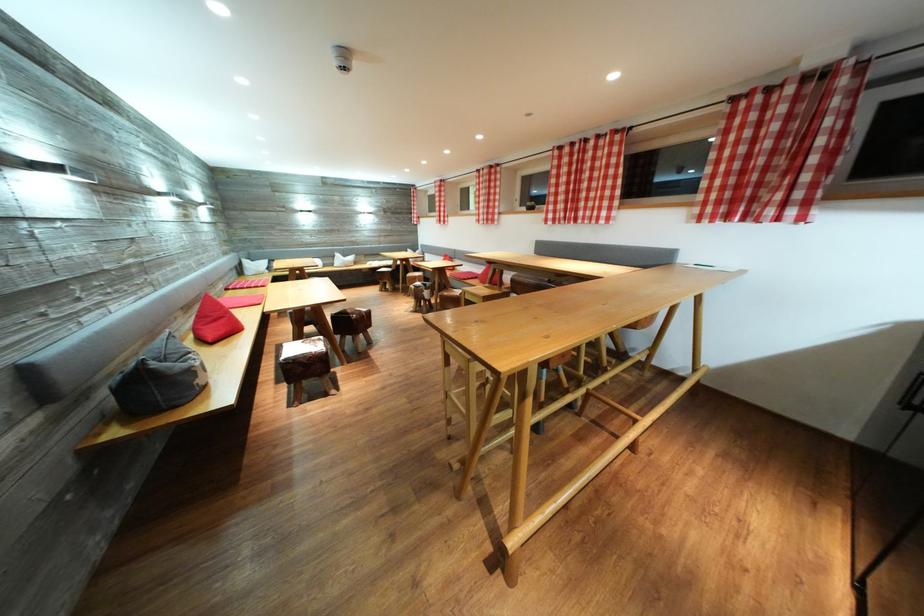
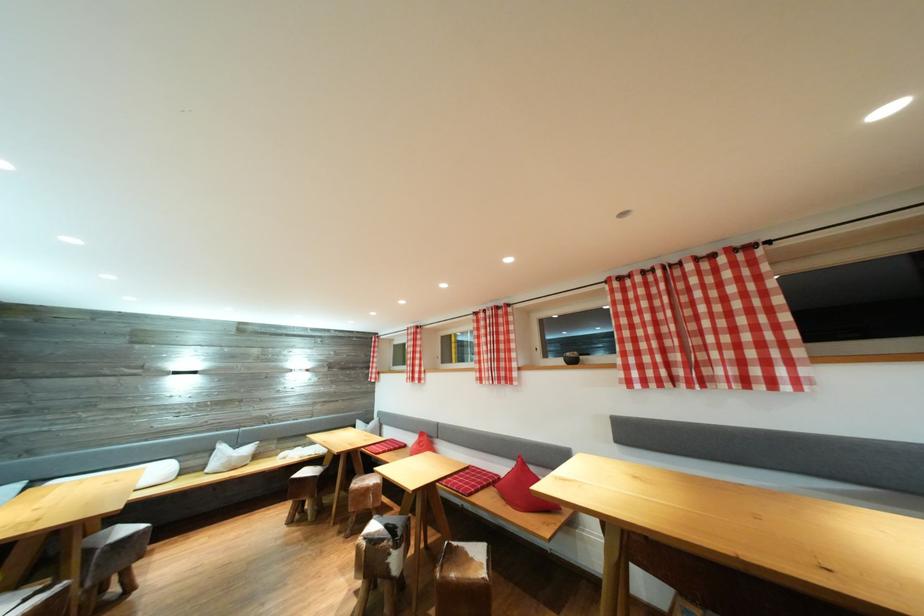
Find the pixel in the second image that matches (421,292) in the first image.

(377, 546)